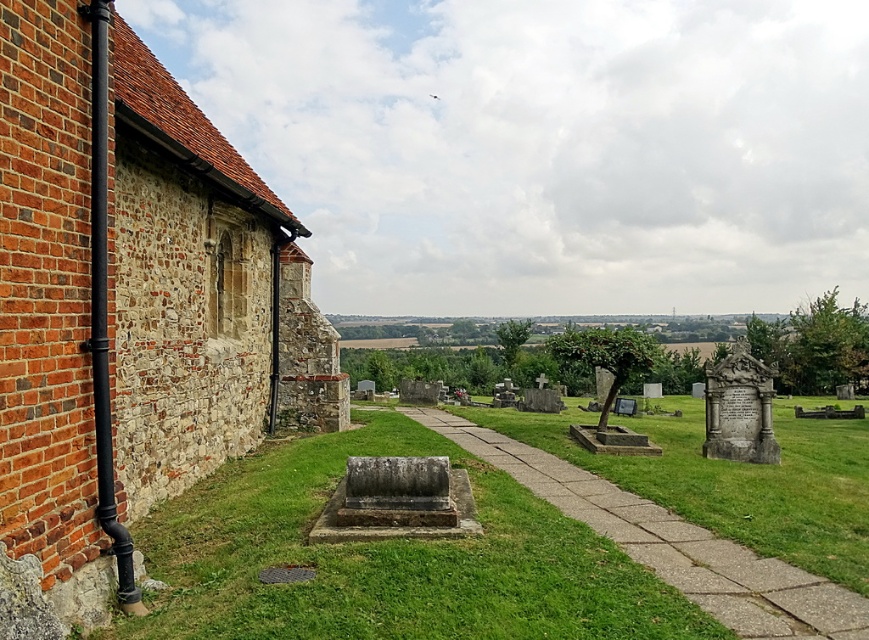
Question: Which object is closer to the camera taking this photo?

Choices:
 (A) concrete paving at center
 (B) green grass at center

Answer: (A)

Question: From the image, what is the correct spatial relationship of green grass at center in relation to concrete paving at center?

Choices:
 (A) right
 (B) left

Answer: (B)

Question: Is green grass at center smaller than concrete paving at center?

Choices:
 (A) yes
 (B) no

Answer: (A)

Question: Which point is farther to the camera?

Choices:
 (A) green grass at center
 (B) concrete paving at center

Answer: (A)

Question: Is the position of green grass at center less distant than that of concrete paving at center?

Choices:
 (A) yes
 (B) no

Answer: (B)